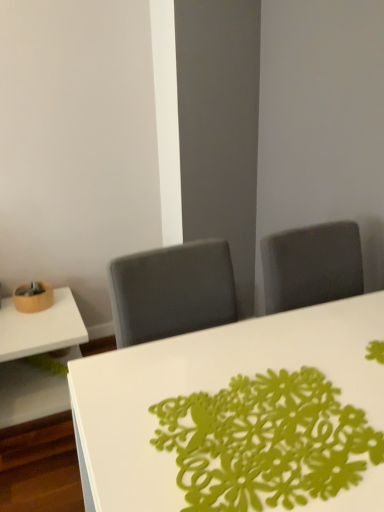
Question: From the image's perspective, is green paper doily at center on top of white glossy table at lower left, the second table viewed from the front?

Choices:
 (A) no
 (B) yes

Answer: (B)

Question: Is green paper doily at center at the left side of white glossy table at lower left, arranged as the second table when viewed from the right?

Choices:
 (A) no
 (B) yes

Answer: (A)

Question: Is green paper doily at center not near white glossy table at lower left, the second table viewed from the front?

Choices:
 (A) no
 (B) yes

Answer: (B)

Question: Is green paper doily at center oriented away from white glossy table at lower left, arranged as the second table when viewed from the right?

Choices:
 (A) yes
 (B) no

Answer: (B)

Question: Could you tell me if green paper doily at center is facing white glossy table at lower left, arranged as the second table when viewed from the right?

Choices:
 (A) no
 (B) yes

Answer: (A)

Question: Is point (183, 441) closer or farther from the camera than point (319, 357)?

Choices:
 (A) farther
 (B) closer

Answer: (B)

Question: Is green paper doily at center taller or shorter than white glossy table at center, the second table when ordered from back to front?

Choices:
 (A) tall
 (B) short

Answer: (B)

Question: Is green paper doily at center in front of or behind white glossy table at center, acting as the 1th table starting from the right, in the image?

Choices:
 (A) front
 (B) behind

Answer: (B)

Question: From the image's perspective, is green paper doily at center located above or below white glossy table at center, acting as the 1th table starting from the right?

Choices:
 (A) above
 (B) below

Answer: (A)

Question: From their relative heights in the image, would you say white glossy table at center, positioned as the 2th table in left-to-right order, is taller or shorter than green paper doily at center?

Choices:
 (A) short
 (B) tall

Answer: (B)

Question: From the image's perspective, relative to green paper doily at center, is white glossy table at center, acting as the 1th table starting from the right, above or below?

Choices:
 (A) above
 (B) below

Answer: (B)

Question: Considering their positions, is white glossy table at center, the second table when ordered from back to front, located in front of or behind green paper doily at center?

Choices:
 (A) front
 (B) behind

Answer: (A)

Question: Based on their sizes in the image, would you say white glossy table at center, the second table when ordered from back to front, is bigger or smaller than green paper doily at center?

Choices:
 (A) small
 (B) big

Answer: (B)

Question: Based on their positions, is white glossy table at lower left, arranged as the second table when viewed from the right, located to the left or right of green paper doily at center?

Choices:
 (A) left
 (B) right

Answer: (A)

Question: In terms of height, does white glossy table at lower left, which ranks as the first table in back-to-front order, look taller or shorter compared to green paper doily at center?

Choices:
 (A) short
 (B) tall

Answer: (B)